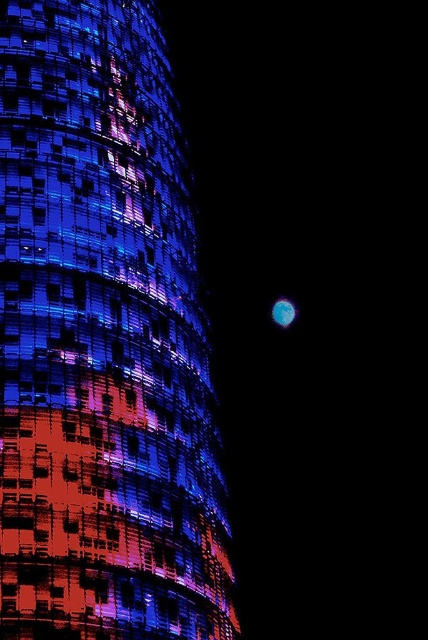
You are an architect analyzing the lighting design of the shiny glass tower at center and the blue translucent sphere at right. Which object is positioned higher in the image?

The shiny glass tower at center is above the blue translucent sphere at right, so it is positioned higher in the image.

You are an architect evaluating the design of the shiny glass tower at center and the blue translucent sphere at right. Which structure has a greater height?

The shiny glass tower at center is taller than the blue translucent sphere at right.

You are standing in front of the shiny glass tower at center and want to locate the blue translucent sphere at right. In which direction should you look relative to the tower?

The shiny glass tower at center is to the left of the blue translucent sphere at right, so you should look to the right of the tower to find the blue translucent sphere at right.